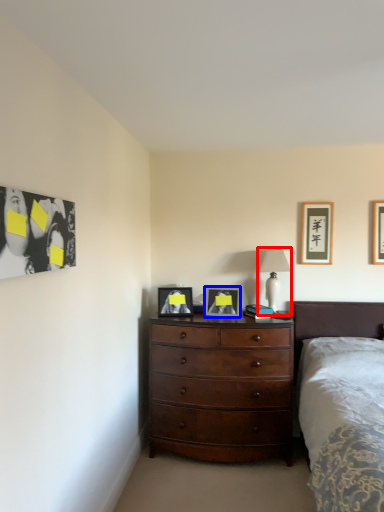
Question: Among these objects, which one is nearest to the camera, lamp (highlighted by a red box) or picture frame (highlighted by a blue box)?

Choices:
 (A) lamp
 (B) picture frame

Answer: (B)